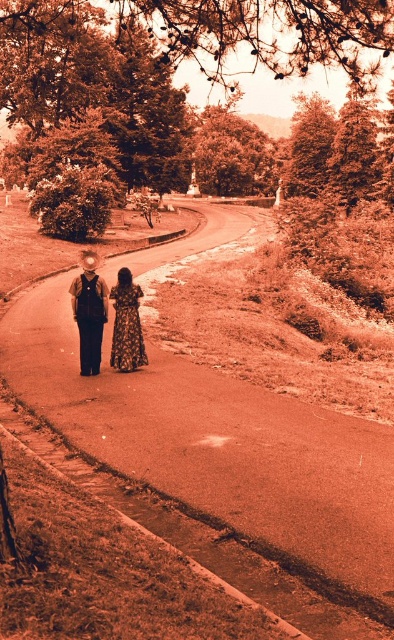
Can you confirm if smooth asphalt road at center is thinner than matte black dress at center?

In fact, smooth asphalt road at center might be wider than matte black dress at center.

Describe the element at coordinates (221, 451) in the screenshot. I see `smooth asphalt road at center` at that location.

At what (x,y) coordinates should I click in order to perform the action: click on smooth asphalt road at center. Please return your answer as a coordinate pair (x, y). This screenshot has width=394, height=640. Looking at the image, I should click on (221, 451).

Who is taller, smooth asphalt road at center or floral-patterned fabric dress at center?

With more height is smooth asphalt road at center.

Describe the element at coordinates (221, 451) in the screenshot. I see `smooth asphalt road at center` at that location.

The width and height of the screenshot is (394, 640). I want to click on smooth asphalt road at center, so click(x=221, y=451).

Can you confirm if matte black dress at center is smaller than floral-patterned fabric dress at center?

No, matte black dress at center is not smaller than floral-patterned fabric dress at center.

Is matte black dress at center above floral-patterned fabric dress at center?

Correct, matte black dress at center is located above floral-patterned fabric dress at center.

Does point (118, 324) lie in front of point (115, 364)?

That is False.

The image size is (394, 640). Find the location of `matte black dress at center`. matte black dress at center is located at coordinates (105, 317).